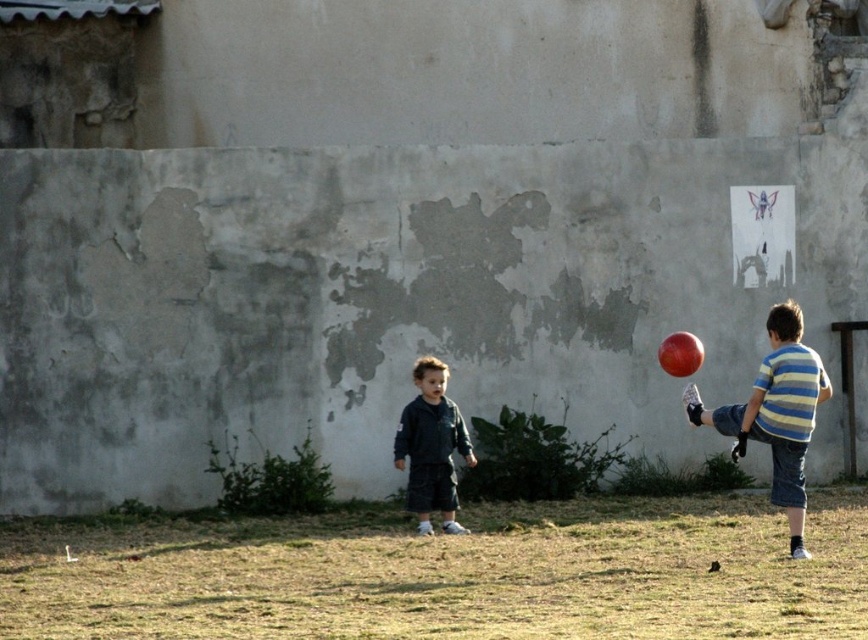
Question: Which point is farther to the camera?

Choices:
 (A) (434, 433)
 (B) (801, 502)

Answer: (A)

Question: Is striped cotton shirt at right to the left of dark blue denim jacket at center from the viewer's perspective?

Choices:
 (A) yes
 (B) no

Answer: (B)

Question: Can you confirm if striped cotton shirt at right is smaller than dark blue denim jacket at center?

Choices:
 (A) yes
 (B) no

Answer: (B)

Question: Which object appears farthest from the camera in this image?

Choices:
 (A) striped cotton shirt at right
 (B) dark blue denim jacket at center

Answer: (B)

Question: Is the position of striped cotton shirt at right less distant than that of dark blue denim jacket at center?

Choices:
 (A) yes
 (B) no

Answer: (A)